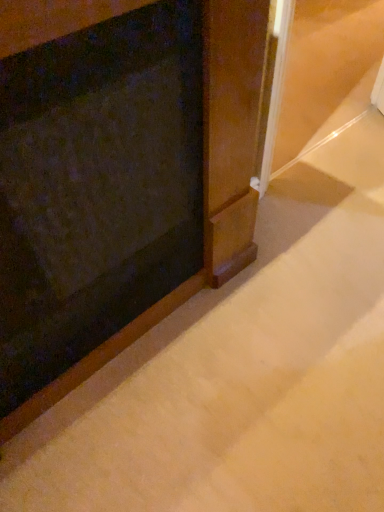
Describe the element at coordinates (96, 198) in the screenshot. I see `dark wood door at lower left` at that location.

What is the approximate width of dark wood door at lower left?

dark wood door at lower left is 9.03 inches in width.

This screenshot has width=384, height=512. Identify the location of dark wood door at lower left. (96, 198).

Where is `dark wood door at lower left`? The image size is (384, 512). dark wood door at lower left is located at coordinates (96, 198).